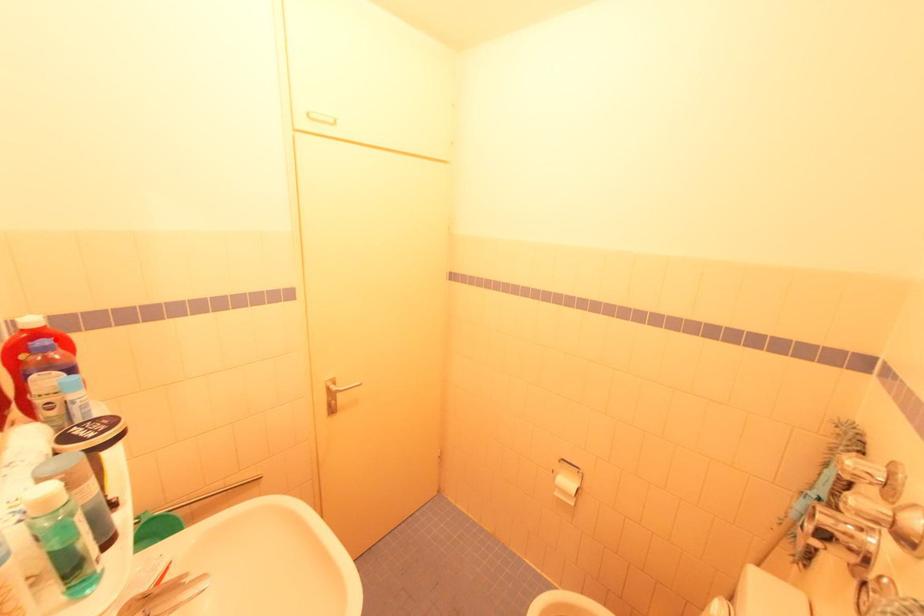
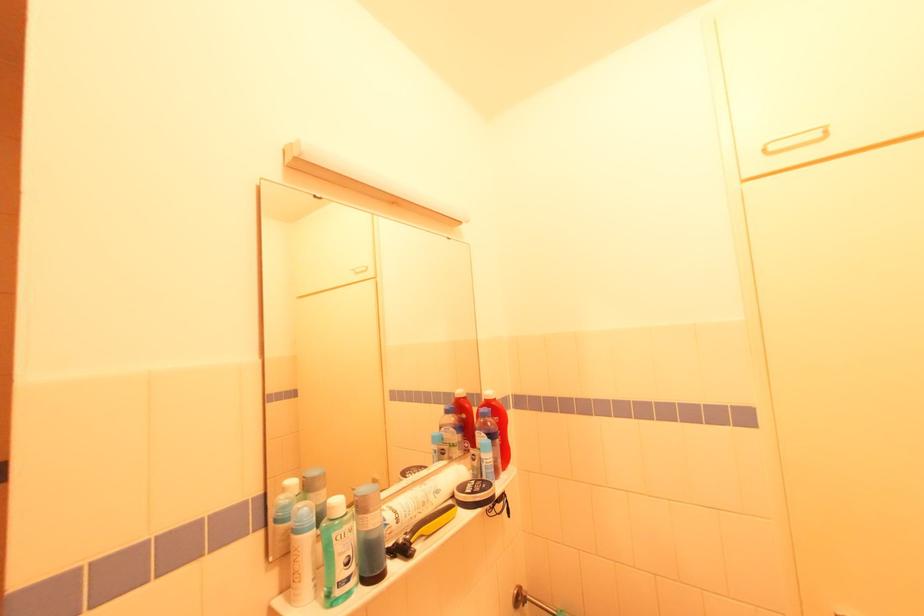
In the second image, find the point that corresponds to the highlighted location in the first image.

(492, 410)